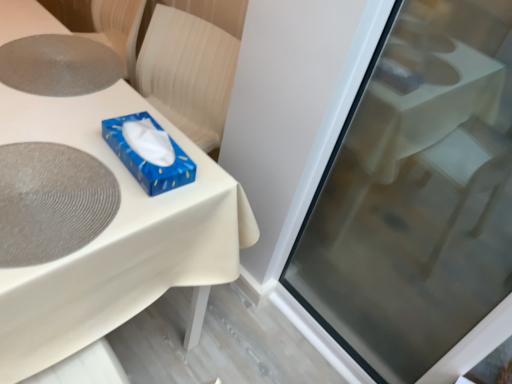
The height and width of the screenshot is (384, 512). Find the location of `unoccupied space behind matte gray placemat at upper left, which is counted as the second oval, starting from the top`. unoccupied space behind matte gray placemat at upper left, which is counted as the second oval, starting from the top is located at coordinates (62, 103).